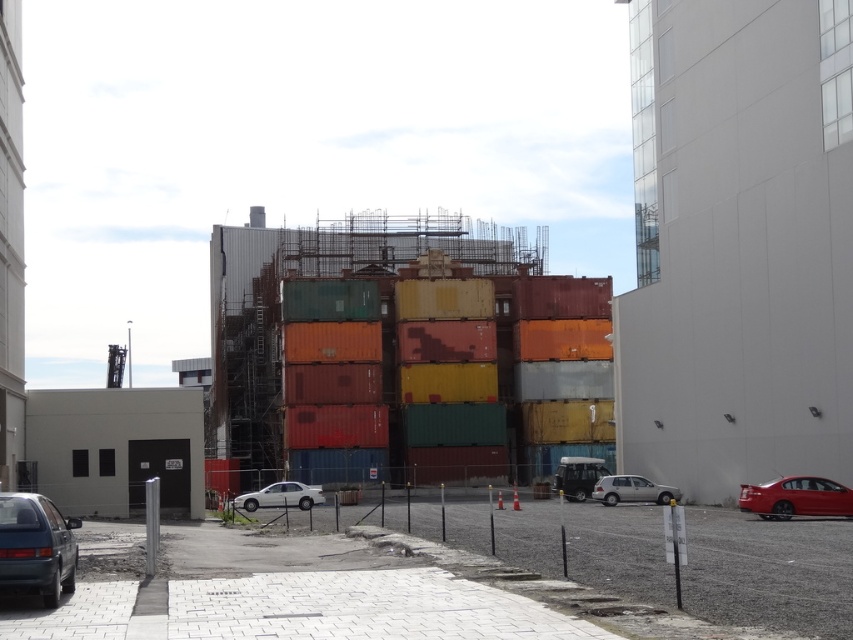
Question: Does matte gray hatchback at lower left have a smaller size compared to shiny red sedan at lower right?

Choices:
 (A) no
 (B) yes

Answer: (B)

Question: Does satin silver car at lower right have a lesser width compared to white glossy sedan at center?

Choices:
 (A) no
 (B) yes

Answer: (B)

Question: Which point is farther to the camera?

Choices:
 (A) (790, 492)
 (B) (300, 484)
 (C) (25, 579)

Answer: (B)

Question: Among these objects, which one is nearest to the camera?

Choices:
 (A) shiny red sedan at lower right
 (B) satin silver car at lower right

Answer: (A)

Question: Which point is farther from the camera taking this photo?

Choices:
 (A) (762, 484)
 (B) (321, 496)
 (C) (621, 476)

Answer: (B)

Question: Is matte gray hatchback at lower left thinner than white glossy sedan at center?

Choices:
 (A) yes
 (B) no

Answer: (A)